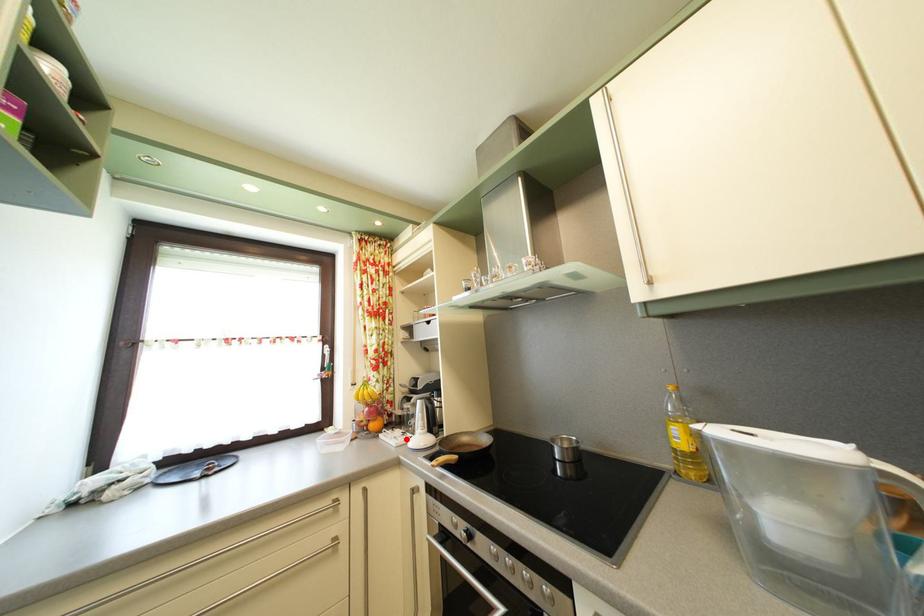
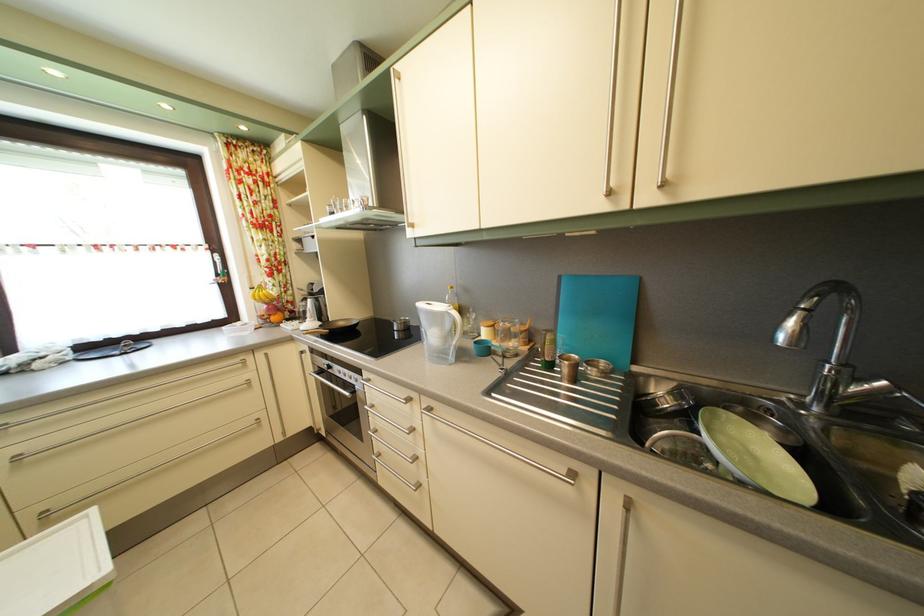
Question: A red point is marked in image1. In image2, is the corresponding 3D point closer to the camera or farther? Reply with the corresponding letter.

Choices:
 (A) The corresponding 3D point is closer.
 (B) The corresponding 3D point is farther.

Answer: (A)